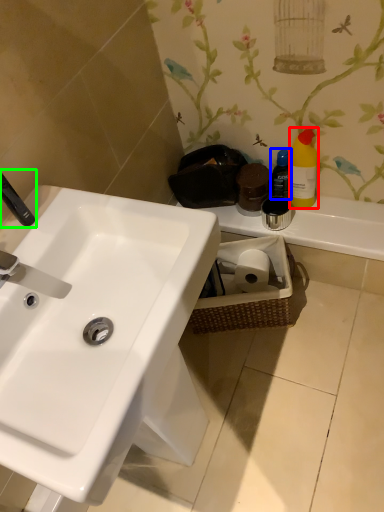
Question: Considering the real-world distances, which object is farthest from cleaning product (highlighted by a red box)? toiletry (highlighted by a blue box) or plumbing fixture (highlighted by a green box)?

Choices:
 (A) toiletry
 (B) plumbing fixture

Answer: (B)